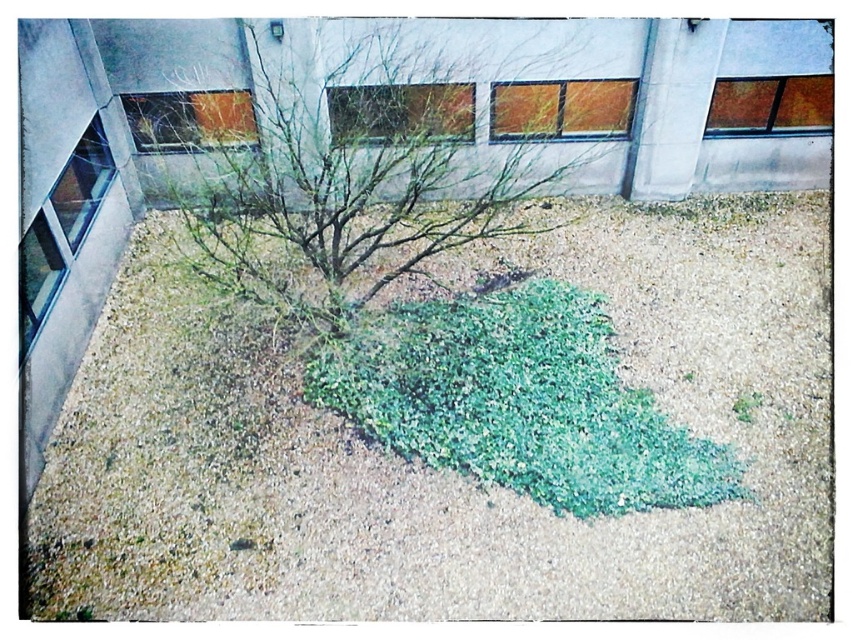
You are standing at the origin point of the coordinate system. You want to walk to the gray gravel at center. In which direction should you move?

The gray gravel at center is located at coordinate point 0.734 on the x axis and 0.523 on the y axis, so you should move in the positive x and positive y direction to reach it.